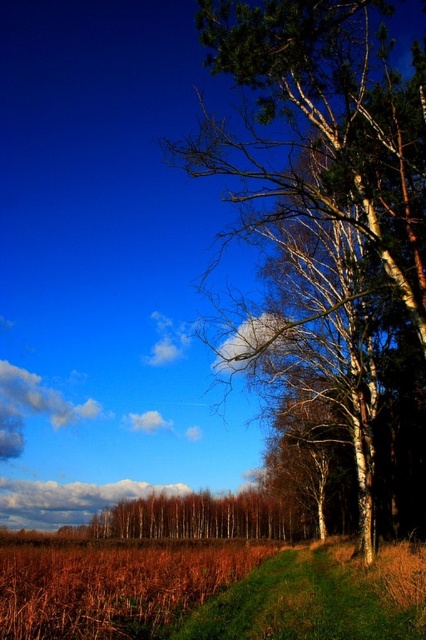
You are a hiker who wants to cross the field in the image. You notice the brown dry grass at lower left and the green grass at lower right. Which area would you choose to walk through if you want to cover more ground with fewer steps?

The brown dry grass at lower left has a larger width than the green grass at lower right, so choosing the brown dry grass at lower left would allow you to cover more ground with fewer steps.

You are a hiker standing at the center of the landscape. You notice the smooth white bark tree at right and the brown dry grass at lower left. Which object is closer to you?

The smooth white bark tree at right is closer to you because the brown dry grass at lower left is behind it.

You are standing in the middle of the landscape and see the smooth white bark tree at right and the brown dry grass at lower left. Which object is positioned higher in the image?

The smooth white bark tree at right is located above the brown dry grass at lower left, so it is positioned higher in the image.